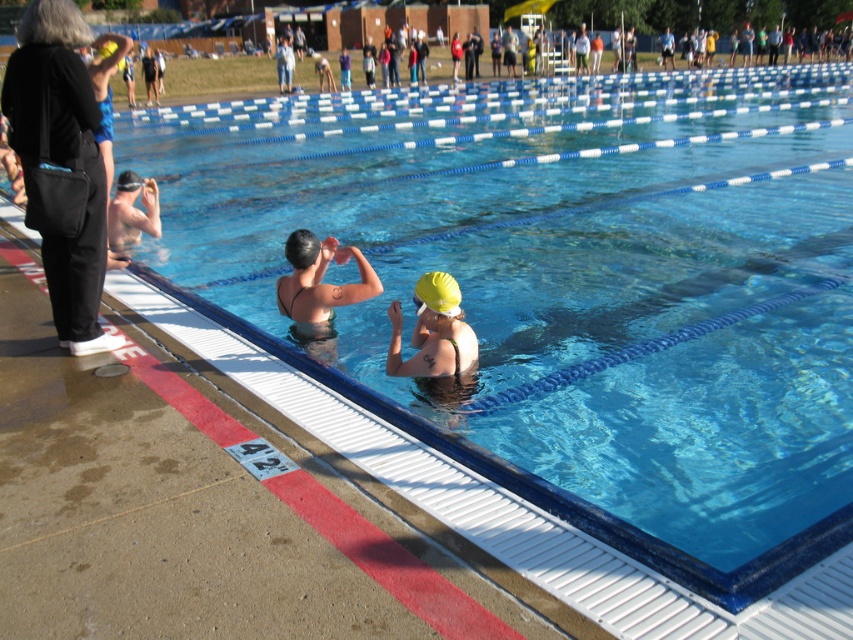
Question: Which object appears farthest from the camera in this image?

Choices:
 (A) yellow matte swim cap at center
 (B) black fabric bag at left

Answer: (A)

Question: Can you confirm if black fabric bag at left is positioned below yellow matte swim cap at center?

Choices:
 (A) yes
 (B) no

Answer: (B)

Question: Among these objects, which one is farthest from the camera?

Choices:
 (A) black fabric bag at left
 (B) yellow matte swim cap at center

Answer: (B)

Question: Is black fabric bag at left to the right of yellow matte swim cap at center from the viewer's perspective?

Choices:
 (A) yes
 (B) no

Answer: (B)

Question: Where is black fabric bag at left located in relation to yellow matte swim cap at center in the image?

Choices:
 (A) right
 (B) left

Answer: (B)